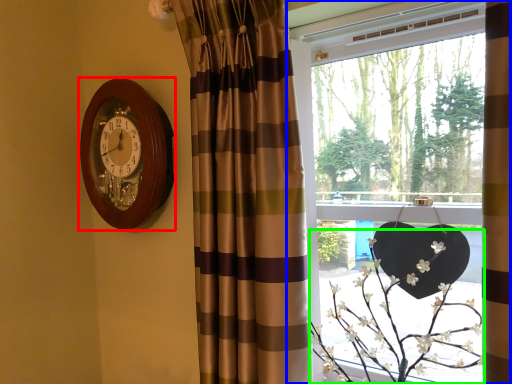
Question: Which object is the farthest from wall clock (highlighted by a red box)? Choose among these: window (highlighted by a blue box) or floral arrangement (highlighted by a green box).

Choices:
 (A) window
 (B) floral arrangement

Answer: (B)